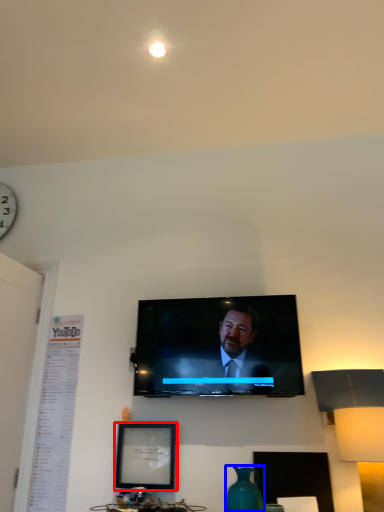
Question: Which point is further to the camera, picture frame (highlighted by a red box) or vase (highlighted by a blue box)?

Choices:
 (A) picture frame
 (B) vase

Answer: (A)